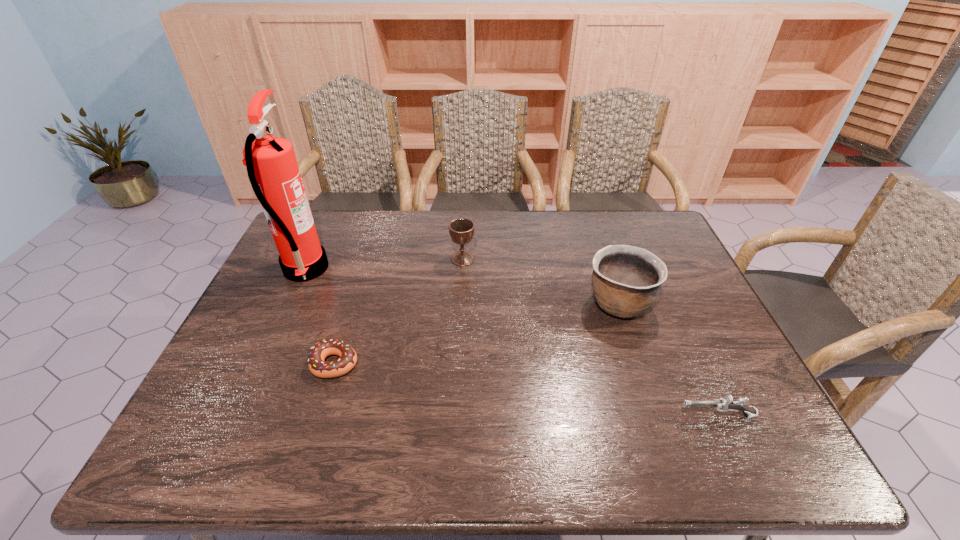
Where is `free space at the far edge`? The image size is (960, 540). free space at the far edge is located at coordinates (346, 238).

Find the location of `vacant region at the near edge of the desktop`. vacant region at the near edge of the desktop is located at coordinates (301, 433).

The height and width of the screenshot is (540, 960). In order to click on free space at the left edge in this screenshot , I will do `click(275, 339)`.

I want to click on vacant space at the right edge of the desktop, so click(x=706, y=299).

In the image, there is a desktop. Where is `vacant space at the near left corner`? This screenshot has width=960, height=540. vacant space at the near left corner is located at coordinates click(204, 441).

Locate an element on the screen. free spot at the far right corner of the desktop is located at coordinates (653, 224).

Identify the location of vacant area between the fourth farthest object and the nearest object. (526, 389).

You are a GUI agent. You are given a task and a screenshot of the screen. Output one action in this format:
    pyautogui.click(x=<x>, y=<y>)
    Task: Click on the free space between the fire extinguisher and the pottery
    Image resolution: width=960 pixels, height=540 pixels.
    Given the screenshot: What is the action you would take?
    pyautogui.click(x=462, y=286)

The width and height of the screenshot is (960, 540). I want to click on free space between the fourth object from right to left and the chalice, so click(398, 311).

What are the coordinates of `free space that is in between the pottery and the fourth tallest object` in the screenshot? It's located at (667, 360).